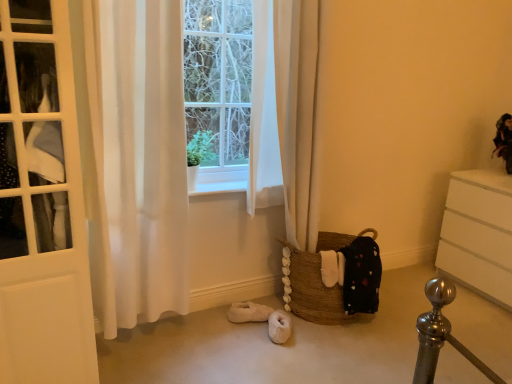
Question: Is brown woven basket at lower center positioned behind velvet-like doll at upper right?

Choices:
 (A) yes
 (B) no

Answer: (B)

Question: Is brown woven basket at lower center wider than velvet-like doll at upper right?

Choices:
 (A) yes
 (B) no

Answer: (A)

Question: From a real-world perspective, is brown woven basket at lower center located beneath velvet-like doll at upper right?

Choices:
 (A) yes
 (B) no

Answer: (A)

Question: Is brown woven basket at lower center shorter than velvet-like doll at upper right?

Choices:
 (A) no
 (B) yes

Answer: (A)

Question: Is brown woven basket at lower center looking in the opposite direction of velvet-like doll at upper right?

Choices:
 (A) yes
 (B) no

Answer: (B)

Question: Is brown woven basket at lower center thinner than velvet-like doll at upper right?

Choices:
 (A) yes
 (B) no

Answer: (B)

Question: Does white wood at center have a lesser width compared to white matte chest of drawers at right?

Choices:
 (A) yes
 (B) no

Answer: (A)

Question: Is white wood at center positioned far away from white matte chest of drawers at right?

Choices:
 (A) no
 (B) yes

Answer: (B)

Question: Is white wood at center facing away from white matte chest of drawers at right?

Choices:
 (A) no
 (B) yes

Answer: (A)

Question: From a real-world perspective, is white wood at center on white matte chest of drawers at right?

Choices:
 (A) yes
 (B) no

Answer: (A)

Question: Is white wood at center smaller than white matte chest of drawers at right?

Choices:
 (A) no
 (B) yes

Answer: (B)

Question: From the image's perspective, would you say white wood at center is shown under white matte chest of drawers at right?

Choices:
 (A) yes
 (B) no

Answer: (B)

Question: Is white sheer curtain at left at the back of white wood at center?

Choices:
 (A) yes
 (B) no

Answer: (B)